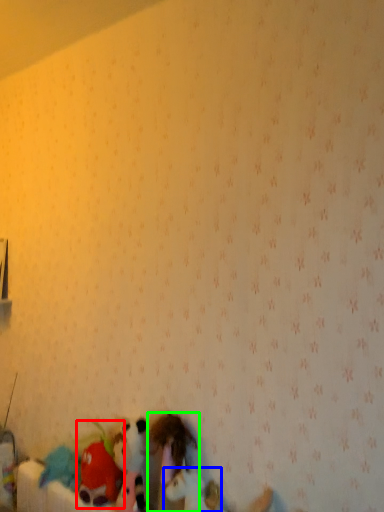
Question: Considering the real-world distances, which object is farthest from toy (highlighted by a red box)? toy (highlighted by a blue box) or toy (highlighted by a green box)?

Choices:
 (A) toy
 (B) toy

Answer: (A)